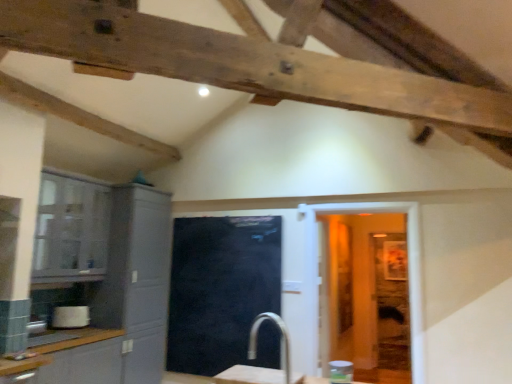
Question: Is matte gray cabinet at lower left, the 1th cabinetry positioned from the front, taller or shorter than matte gray cabinet at left, positioned as the first cabinetry in back-to-front order?

Choices:
 (A) short
 (B) tall

Answer: (A)

Question: Based on their positions, is matte gray cabinet at lower left, the 1th cabinetry positioned from the front, located to the left or right of matte gray cabinet at left, positioned as the first cabinetry in back-to-front order?

Choices:
 (A) left
 (B) right

Answer: (A)

Question: Which is nearer to the clear plastic jar at lower right, the first appliance when ordered from front to back?

Choices:
 (A) black glass door at center
 (B) white glossy toaster at lower left, marked as the second appliance in a top-to-bottom arrangement
 (C) white glossy door at center
 (D) white marble table at center
 (E) matte gray cabinet at lower left, the third cabinetry when ordered from back to front

Answer: (C)

Question: Based on their relative distances, which object is nearer to the white marble table at center?

Choices:
 (A) matte gray cabinet at left, positioned as the first cabinetry in back-to-front order
 (B) white glossy door at center
 (C) matte gray cabinet at lower left, the 1th cabinetry positioned from the front
 (D) matte gray cabinet at left, which is counted as the second cabinetry, starting from the front
 (E) black glass door at center

Answer: (E)